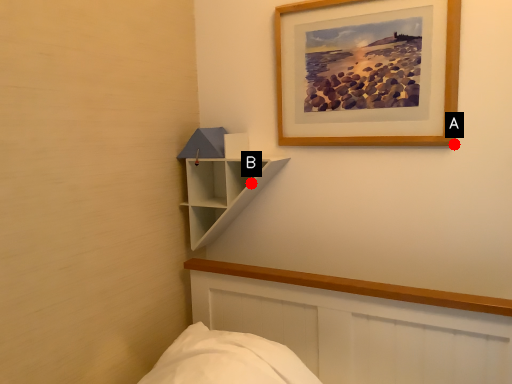
Question: Two points are circled on the image, labeled by A and B beside each circle. Which point appears farthest from the camera in this image?

Choices:
 (A) A is further
 (B) B is further

Answer: (B)